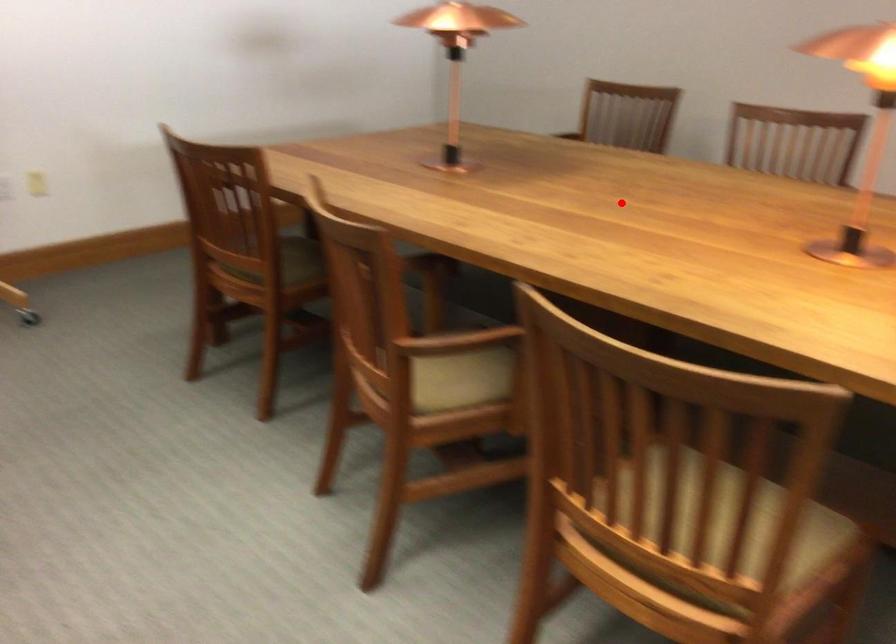
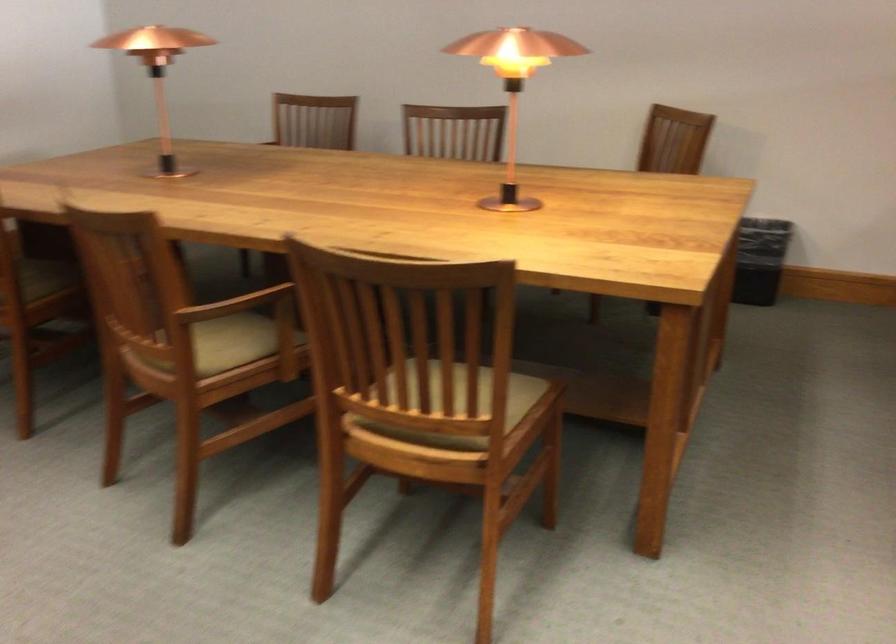
Question: I am providing you with two images of the same scene from different viewpoints. In image1, a red point is highlighted. Considering the same 3D point in image2, which of the following is correct?

Choices:
 (A) It is closer
 (B) It is farther

Answer: (B)